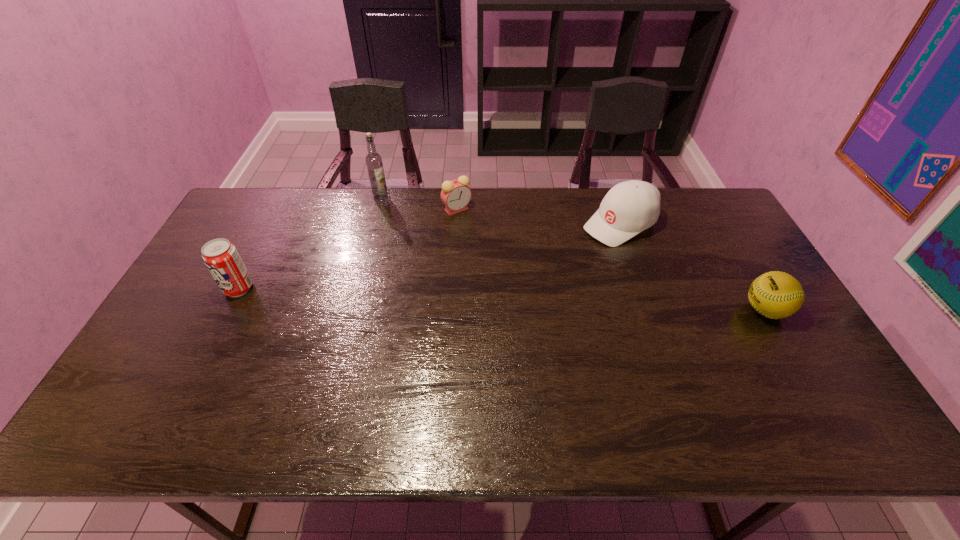
Locate an element on the screen. The image size is (960, 540). free space on the desktop that is between the leftmost object and the rightmost object and is positioned on the label of the tallest object is located at coordinates (421, 296).

The image size is (960, 540). I want to click on free space on the desktop that is between the leftmost object and the softball and is positioned on the face of the alarm clock, so click(x=428, y=296).

You are a GUI agent. You are given a task and a screenshot of the screen. Output one action in this format:
    pyautogui.click(x=<x>, y=<y>)
    Task: Click on the free spot on the desktop that is between the soda can and the softball and is positioned on the front-facing side of the baseball cap
    
    Given the screenshot: What is the action you would take?
    pyautogui.click(x=490, y=299)